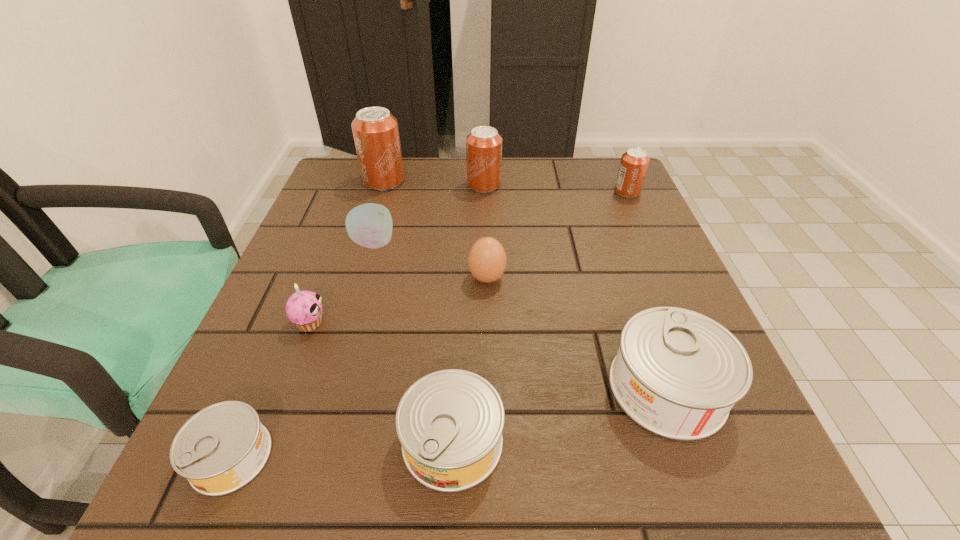
Identify the location of vacant space that is in between the second smallest orange can and the apple. The height and width of the screenshot is (540, 960). (429, 214).

At what (x,y) coordinates should I click in order to perform the action: click on empty space between the apple and the second orange can from right to left. Please return your answer as a coordinate pair (x, y). Looking at the image, I should click on (429, 214).

Locate an element on the screen. The image size is (960, 540). free point between the smallest orange can and the second silver can from left to right is located at coordinates (540, 316).

Identify which object is the nearest to the boiled egg. Please provide its 2D coordinates. Your answer should be formatted as a tuple, i.e. [(x, y)], where the tuple contains the x and y coordinates of a point satisfying the conditions above.

[(370, 225)]

Locate an element on the screen. The image size is (960, 540). object that ranks as the fourth closest to the apple is located at coordinates (483, 145).

Locate which can ranks sixth in proximity to the apple. Please provide its 2D coordinates. Your answer should be formatted as a tuple, i.e. [(x, y)], where the tuple contains the x and y coordinates of a point satisfying the conditions above.

[(634, 162)]

Identify the location of the fifth closest can to the brown boiled egg. [634, 162].

Point out which orange can is positioned as the nearest to the biggest orange can. Please provide its 2D coordinates. Your answer should be formatted as a tuple, i.e. [(x, y)], where the tuple contains the x and y coordinates of a point satisfying the conditions above.

[(483, 145)]

Select which orange can is the second closest to the white apple. Please provide its 2D coordinates. Your answer should be formatted as a tuple, i.e. [(x, y)], where the tuple contains the x and y coordinates of a point satisfying the conditions above.

[(483, 145)]

At what (x,y) coordinates should I click in order to perform the action: click on silver can that is the second closest to the biggest silver can. Please return your answer as a coordinate pair (x, y). Image resolution: width=960 pixels, height=540 pixels. Looking at the image, I should click on tap(223, 447).